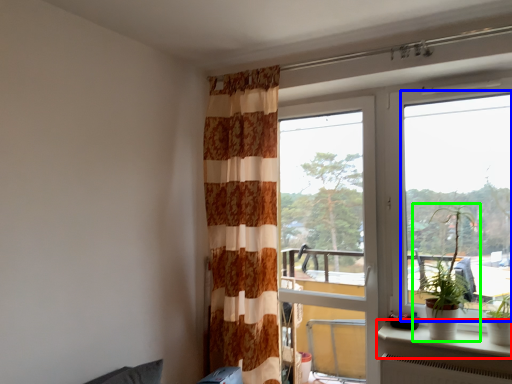
Question: Which is farther away from window sill (highlighted by a red box)? window (highlighted by a blue box) or houseplant (highlighted by a green box)?

Choices:
 (A) window
 (B) houseplant

Answer: (A)